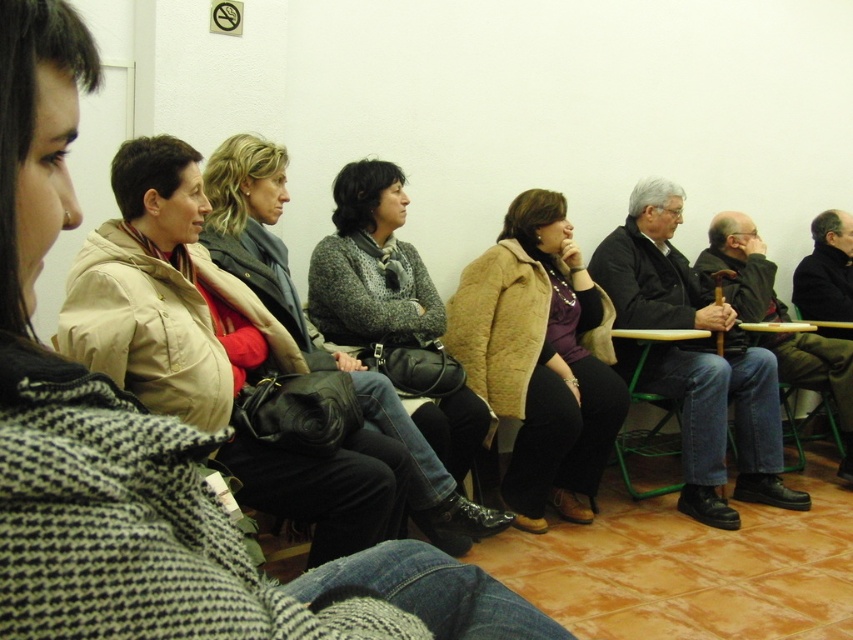
Question: Does beige fabric coat at upper left appear on the left side of beige fuzzy coat at center?

Choices:
 (A) yes
 (B) no

Answer: (A)

Question: From the image, what is the correct spatial relationship of gray knit sweater at center in relation to matte black purse at center?

Choices:
 (A) above
 (B) below

Answer: (A)

Question: Among these objects, which one is farthest from the camera?

Choices:
 (A) green metal chair at lower center
 (B) beige fuzzy coat at center
 (C) gray knit sweater at center
 (D) dark gray sweater at center

Answer: (A)

Question: Which of these objects is positioned farthest from the gray knit sweater at center?

Choices:
 (A) matte black purse at center
 (B) beige fuzzy coat at center

Answer: (B)

Question: Which object is positioned farthest from the gray knit sweater at center?

Choices:
 (A) green metal chair at lower center
 (B) beige fabric coat at upper left
 (C) beige fuzzy coat at center
 (D) dark gray sweater at center

Answer: (D)

Question: Does dark gray sweater at center lie in front of gray knit sweater at center?

Choices:
 (A) no
 (B) yes

Answer: (A)